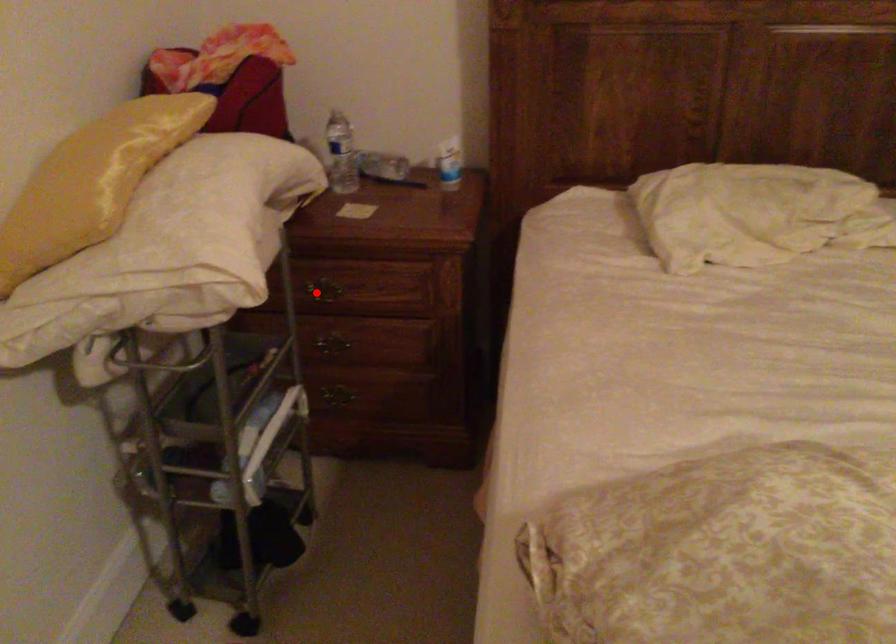
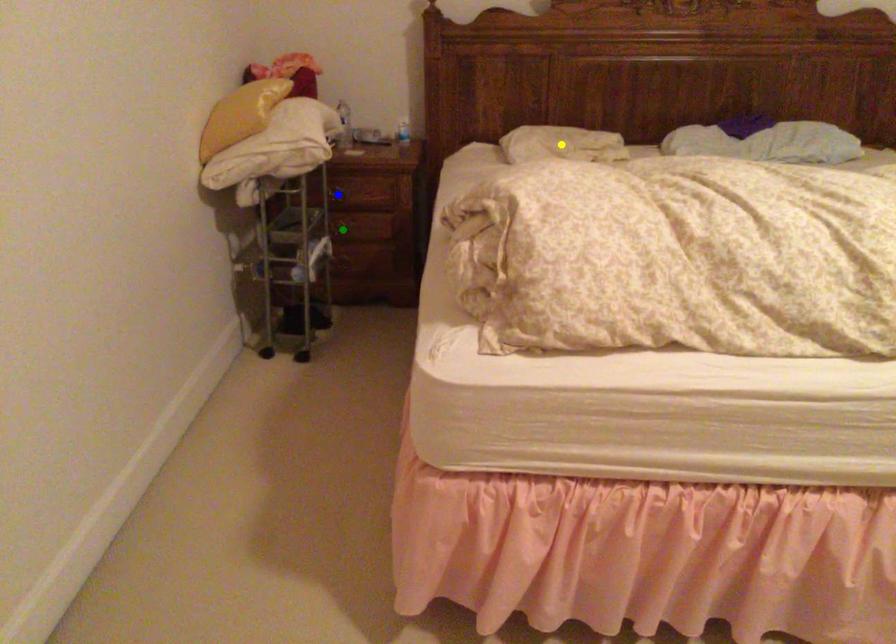
Question: I am providing you with two images of the same scene from different viewpoints. A red point is marked on the first image. You are given multiple points on the second image. Which point in image 2 represents the same 3d spot as the red point in image 1?

Choices:
 (A) yellow point
 (B) blue point
 (C) green point

Answer: (B)